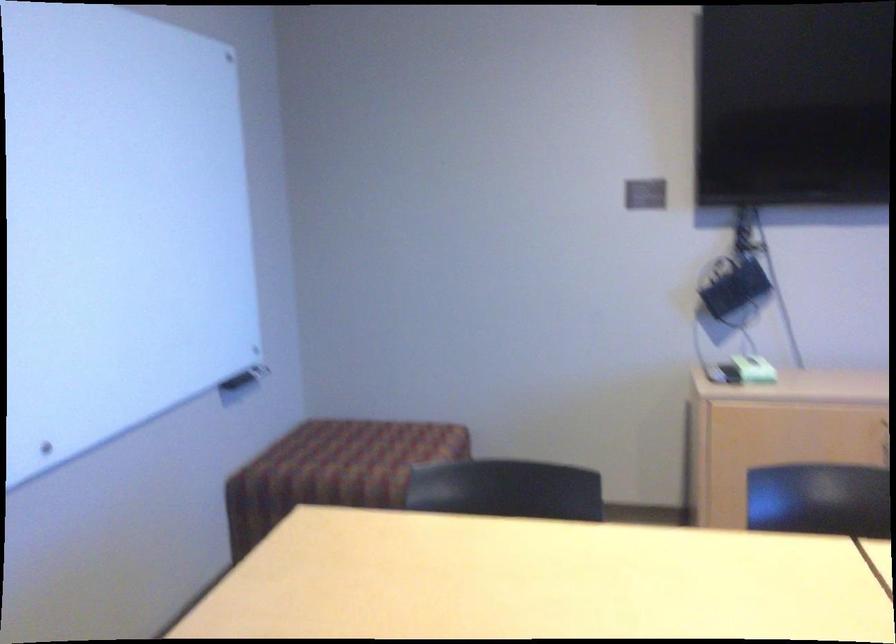
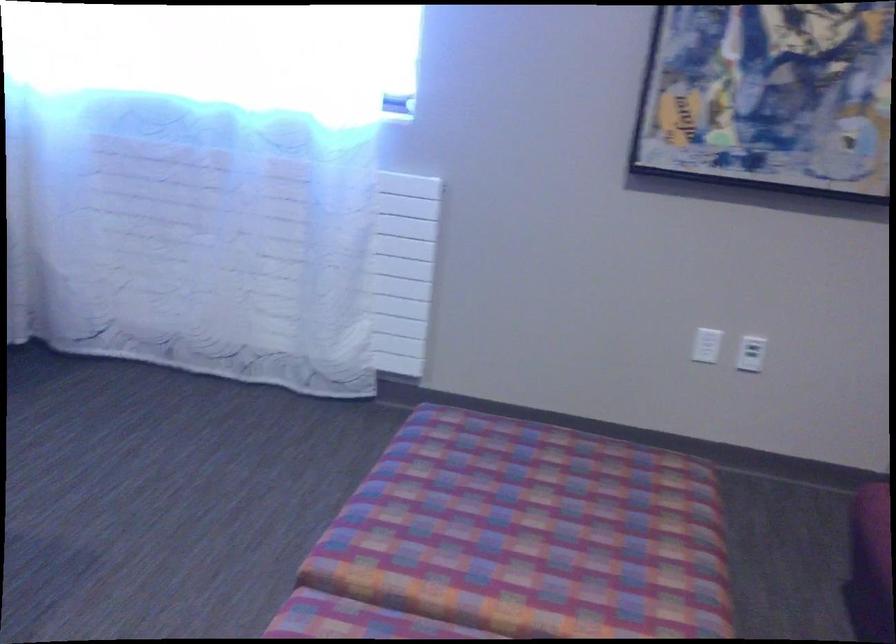
First-person continuous shooting, in which direction is the camera rotating?

The rotation direction of the camera is right-down.